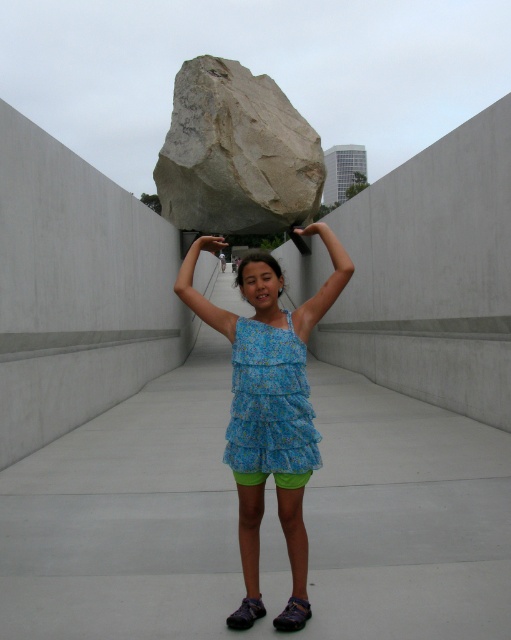
Question: Which of the following is the farthest from the observer?

Choices:
 (A) (244, 253)
 (B) (239, 342)
 (C) (233, 109)

Answer: (A)

Question: Does blue floral dress at center have a lesser width compared to matte blue dress at center?

Choices:
 (A) yes
 (B) no

Answer: (B)

Question: Does gray rough rock at center appear under matte blue dress at center?

Choices:
 (A) no
 (B) yes

Answer: (A)

Question: Which is nearer to the blue floral dress at center?

Choices:
 (A) matte blue dress at center
 (B) gray rough rock at center

Answer: (A)

Question: Can you confirm if blue floral dress at center is thinner than matte blue dress at center?

Choices:
 (A) yes
 (B) no

Answer: (B)

Question: Which object is farther from the camera taking this photo?

Choices:
 (A) blue floral dress at center
 (B) gray rough rock at center

Answer: (B)